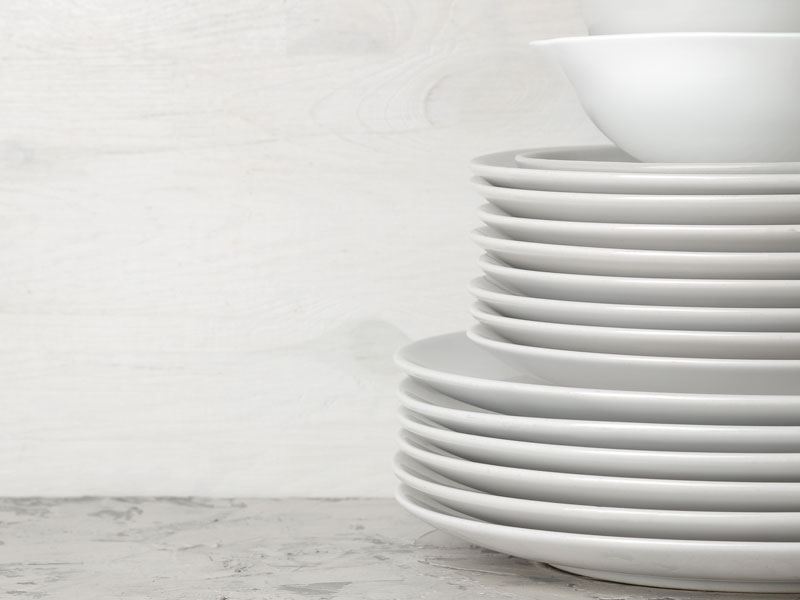
Identify the location of large plates. The height and width of the screenshot is (600, 800). (574, 557), (560, 514), (561, 490), (560, 461), (548, 433), (546, 400).